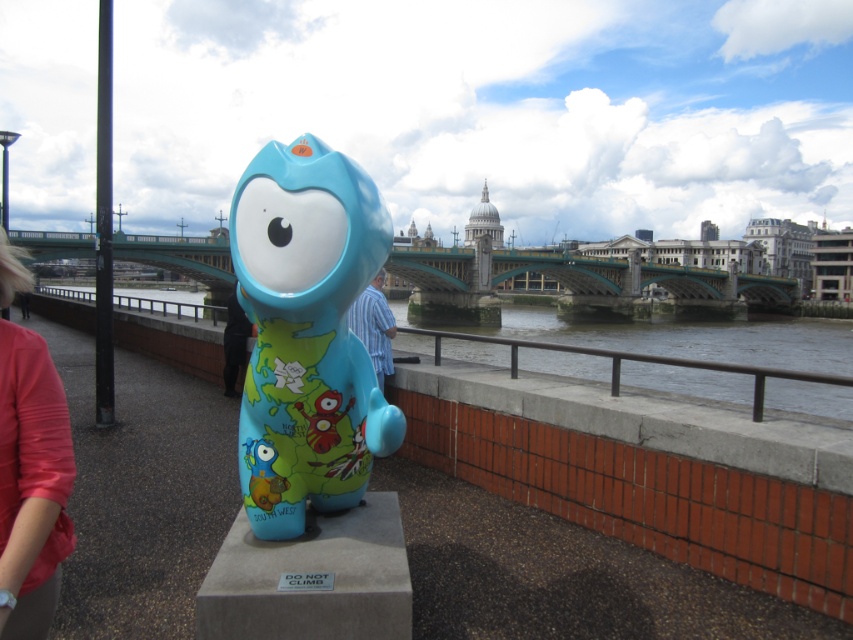
Question: Can you confirm if matte plastic sculpture at center is bigger than matte blue statue at center?

Choices:
 (A) yes
 (B) no

Answer: (B)

Question: Considering the real-world distances, which object is closest to the blue striped shirt at center?

Choices:
 (A) matte plastic sculpture at center
 (B) matte blue statue at center

Answer: (B)

Question: From the image, what is the correct spatial relationship of pink satin blouse at lower left in relation to matte blue statue at center?

Choices:
 (A) above
 (B) below

Answer: (B)

Question: Which of the following is the farthest from the observer?

Choices:
 (A) blue striped shirt at center
 (B) matte plastic sculpture at center
 (C) pink satin blouse at lower left
 (D) matte blue statue at center

Answer: (A)

Question: Based on their relative distances, which object is farther from the matte plastic sculpture at center?

Choices:
 (A) pink satin blouse at lower left
 (B) matte blue statue at center
 (C) blue striped shirt at center

Answer: (C)

Question: Can you confirm if blue striped shirt at center is positioned above matte blue statue at center?

Choices:
 (A) yes
 (B) no

Answer: (A)